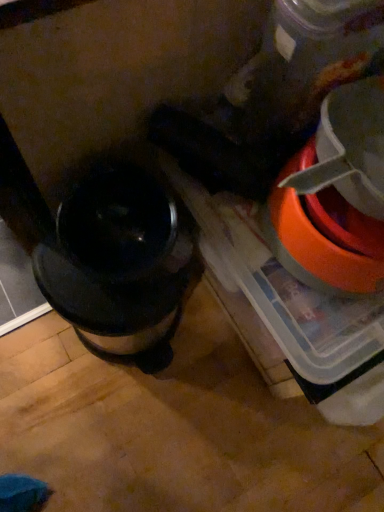
This screenshot has width=384, height=512. Describe the element at coordinates (121, 266) in the screenshot. I see `shiny metallic coffee maker at left` at that location.

You are a GUI agent. You are given a task and a screenshot of the screen. Output one action in this format:
    pyautogui.click(x=<x>, y=<y>)
    Task: Click on the shiny metallic coffee maker at left
    The height and width of the screenshot is (512, 384).
    Given the screenshot: What is the action you would take?
    pyautogui.click(x=121, y=266)

Describe the element at coordinates (335, 197) in the screenshot. I see `orange plastic bowl at right` at that location.

At what (x,y) coordinates should I click in order to perform the action: click on orange plastic bowl at right. Please return your answer as a coordinate pair (x, y). This screenshot has height=512, width=384. Looking at the image, I should click on (335, 197).

This screenshot has width=384, height=512. I want to click on shiny metallic coffee maker at left, so (121, 266).

In the scene shown: Between orange plastic bowl at right and shiny metallic coffee maker at left, which one appears on the left side from the viewer's perspective?

From the viewer's perspective, shiny metallic coffee maker at left appears more on the left side.

In the image, is orange plastic bowl at right positioned in front of or behind shiny metallic coffee maker at left?

orange plastic bowl at right is positioned closer to the viewer than shiny metallic coffee maker at left.

Is point (336, 92) farther from viewer compared to point (56, 275)?

No, (336, 92) is closer to viewer.

From the image's perspective, between orange plastic bowl at right and shiny metallic coffee maker at left, which one is located above?

orange plastic bowl at right is shown above in the image.

From a real-world perspective, relative to shiny metallic coffee maker at left, is orange plastic bowl at right vertically above or below?

Clearly, from a real-world perspective, orange plastic bowl at right is above shiny metallic coffee maker at left.

Which of these two, orange plastic bowl at right or shiny metallic coffee maker at left, is wider?

Wider between the two is shiny metallic coffee maker at left.

Considering the sizes of objects orange plastic bowl at right and shiny metallic coffee maker at left in the image provided, who is shorter, orange plastic bowl at right or shiny metallic coffee maker at left?

orange plastic bowl at right is shorter.

Considering the sizes of objects orange plastic bowl at right and shiny metallic coffee maker at left in the image provided, who is bigger, orange plastic bowl at right or shiny metallic coffee maker at left?

shiny metallic coffee maker at left.

Consider the image. Is orange plastic bowl at right positioned beyond the bounds of shiny metallic coffee maker at left?

orange plastic bowl at right is positioned outside shiny metallic coffee maker at left.

Are orange plastic bowl at right and shiny metallic coffee maker at left far apart?

No, orange plastic bowl at right is not far away from shiny metallic coffee maker at left.

Is orange plastic bowl at right positioned with its back to shiny metallic coffee maker at left?

No, orange plastic bowl at right is not facing the opposite direction of shiny metallic coffee maker at left.

Where is `appliance lying on the right of shiny metallic coffee maker at left`? The width and height of the screenshot is (384, 512). appliance lying on the right of shiny metallic coffee maker at left is located at coordinates (x=335, y=197).

Which is more to the left, shiny metallic coffee maker at left or orange plastic bowl at right?

shiny metallic coffee maker at left is more to the left.

Who is more distant, shiny metallic coffee maker at left or orange plastic bowl at right?

shiny metallic coffee maker at left is further away from the camera.

Is point (167, 300) in front of point (379, 272)?

No, (167, 300) is further to viewer.

From the image's perspective, relative to orange plastic bowl at right, is shiny metallic coffee maker at left above or below?

Based on their image positions, shiny metallic coffee maker at left is located beneath orange plastic bowl at right.

From a real-world perspective, who is located higher, shiny metallic coffee maker at left or orange plastic bowl at right?

From a 3D spatial view, orange plastic bowl at right is above.

Does shiny metallic coffee maker at left have a lesser width compared to orange plastic bowl at right?

In fact, shiny metallic coffee maker at left might be wider than orange plastic bowl at right.

Considering the relative sizes of shiny metallic coffee maker at left and orange plastic bowl at right in the image provided, is shiny metallic coffee maker at left shorter than orange plastic bowl at right?

Incorrect, the height of shiny metallic coffee maker at left does not fall short of that of orange plastic bowl at right.

Who is bigger, shiny metallic coffee maker at left or orange plastic bowl at right?

shiny metallic coffee maker at left.

In the scene shown: Is shiny metallic coffee maker at left completely or partially outside of orange plastic bowl at right?

shiny metallic coffee maker at left is positioned outside orange plastic bowl at right.

Is shiny metallic coffee maker at left positioned far away from orange plastic bowl at right?

shiny metallic coffee maker at left is actually quite close to orange plastic bowl at right.

Is shiny metallic coffee maker at left facing towards orange plastic bowl at right?

No, shiny metallic coffee maker at left is not turned towards orange plastic bowl at right.

How different are the orientations of shiny metallic coffee maker at left and orange plastic bowl at right in degrees?

There is a 0.00133-degree angle between the facing directions of shiny metallic coffee maker at left and orange plastic bowl at right.

The height and width of the screenshot is (512, 384). I want to click on appliance above the shiny metallic coffee maker at left (from a real-world perspective), so click(335, 197).

Find the location of a particular element. This screenshot has height=512, width=384. appliance above the shiny metallic coffee maker at left (from the image's perspective) is located at coordinates (335, 197).

Locate an element on the screen. This screenshot has width=384, height=512. appliance located in front of the shiny metallic coffee maker at left is located at coordinates (335, 197).